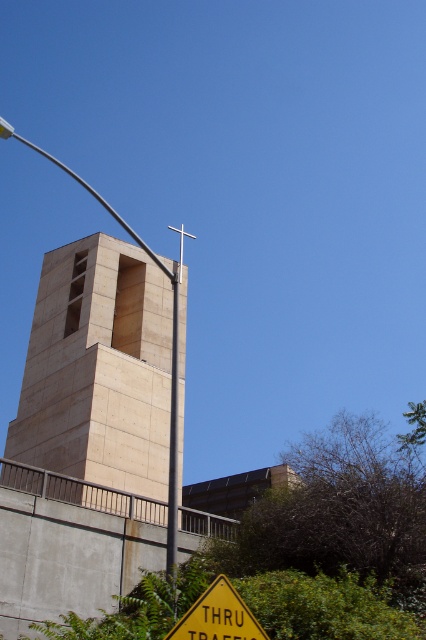
Does beige stone bell tower at center have a lesser width compared to metallic gray pole at center?

Incorrect, beige stone bell tower at center's width is not less than metallic gray pole at center's.

This screenshot has height=640, width=426. What do you see at coordinates (98, 369) in the screenshot? I see `beige stone bell tower at center` at bounding box center [98, 369].

Identify the location of beige stone bell tower at center. This screenshot has height=640, width=426. (98, 369).

Can you confirm if beige stone bell tower at center is positioned below yellow matte traffic sign at lower center?

Indeed, beige stone bell tower at center is positioned under yellow matte traffic sign at lower center.

This screenshot has height=640, width=426. What do you see at coordinates (98, 369) in the screenshot? I see `beige stone bell tower at center` at bounding box center [98, 369].

At what (x,y) coordinates should I click in order to perform the action: click on beige stone bell tower at center. Please return your answer as a coordinate pair (x, y). Looking at the image, I should click on (98, 369).

Does yellow matte traffic sign at lower center appear over metallic gray pole at center?

No.

Is yellow matte traffic sign at lower center smaller than metallic gray pole at center?

Indeed, yellow matte traffic sign at lower center has a smaller size compared to metallic gray pole at center.

Is point (247, 611) less distant than point (170, 460)?

Yes, it is in front of point (170, 460).

In order to click on yellow matte traffic sign at lower center in this screenshot , I will do `click(218, 616)`.